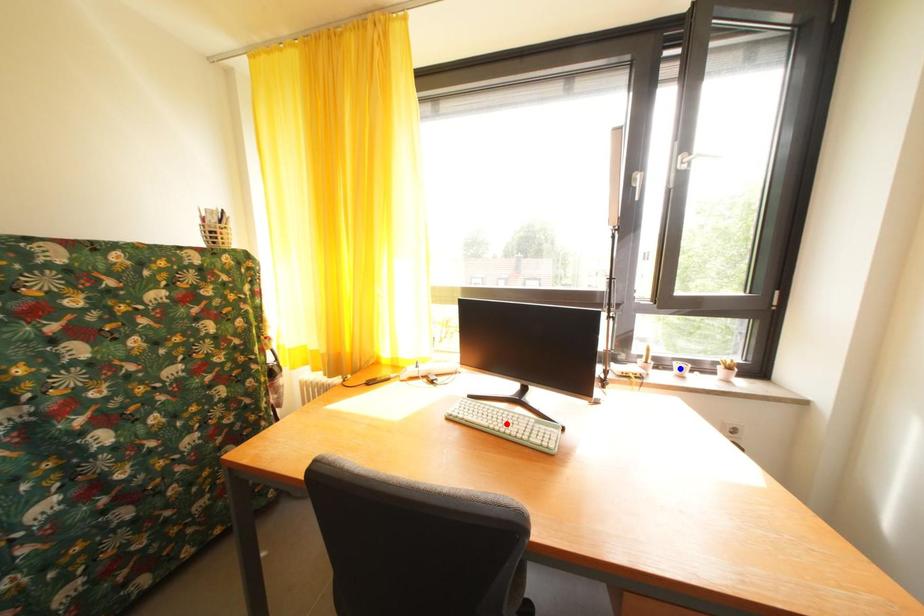
Question: In the image, two points are highlighted. Which point is nearer to the camera? Reply with the corresponding letter.

Choices:
 (A) blue point
 (B) red point

Answer: (B)